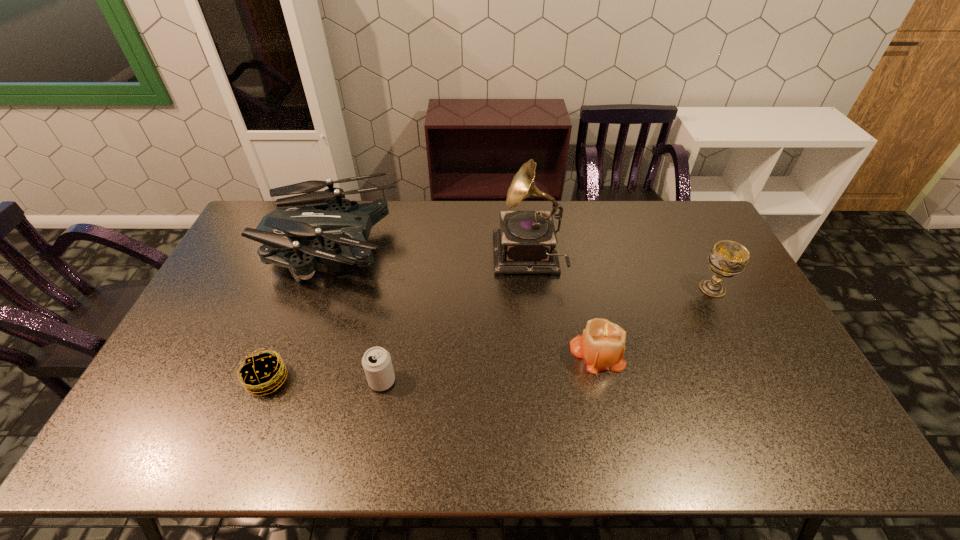
In the image, there is a desktop. At what (x,y) coordinates should I click in order to perform the action: click on vacant space at the left edge. Please return your answer as a coordinate pair (x, y). The height and width of the screenshot is (540, 960). Looking at the image, I should click on (194, 390).

What are the coordinates of `vacant area at the right edge` in the screenshot? It's located at (775, 380).

The width and height of the screenshot is (960, 540). In the image, there is a desktop. Identify the location of vacant space at the far left corner. (262, 206).

This screenshot has height=540, width=960. Find the location of `vacant space at the near left corner`. vacant space at the near left corner is located at coordinates (120, 452).

The height and width of the screenshot is (540, 960). I want to click on free space between the shortest object and the can, so click(x=324, y=380).

The image size is (960, 540). Find the location of `free space between the second shortest object and the tallest object`. free space between the second shortest object and the tallest object is located at coordinates (455, 320).

This screenshot has height=540, width=960. In order to click on vacant area between the drone and the shortest object in this screenshot , I will do `click(300, 314)`.

This screenshot has width=960, height=540. Identify the location of vacant space that's between the can and the patty. (324, 380).

Identify the location of vacant area that lies between the drone and the tallest object. (429, 253).

The height and width of the screenshot is (540, 960). Identify the location of empty location between the candle and the rightmost object. (655, 321).